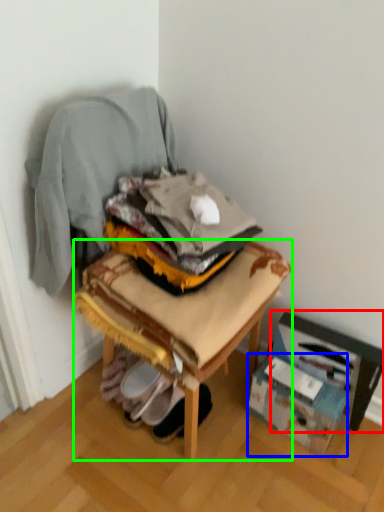
Question: Which is nearer to the cardboard box (highlighted by a red box)? cardboard box (highlighted by a blue box) or furniture (highlighted by a green box).

Choices:
 (A) cardboard box
 (B) furniture

Answer: (A)